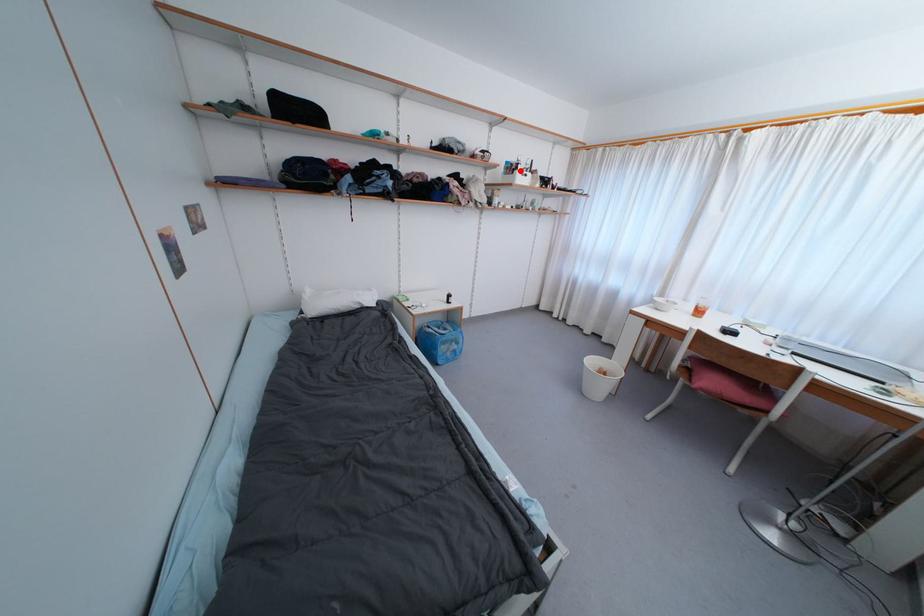
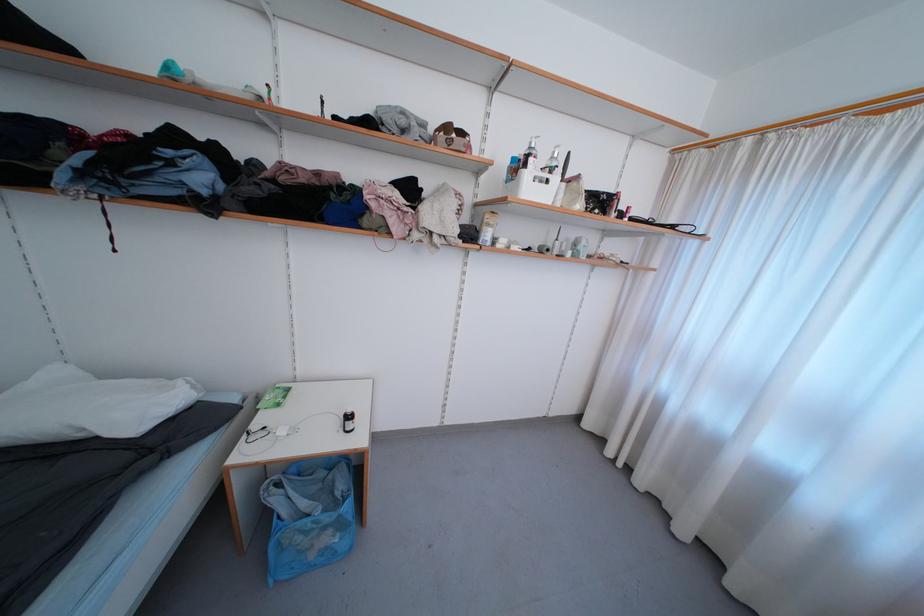
Question: I am providing you with two images of the same scene from different viewpoints. Given a red point in image1, look at the same physical point in image2. Is it:

Choices:
 (A) Closer to the viewpoint
 (B) Farther from the viewpoint

Answer: (B)